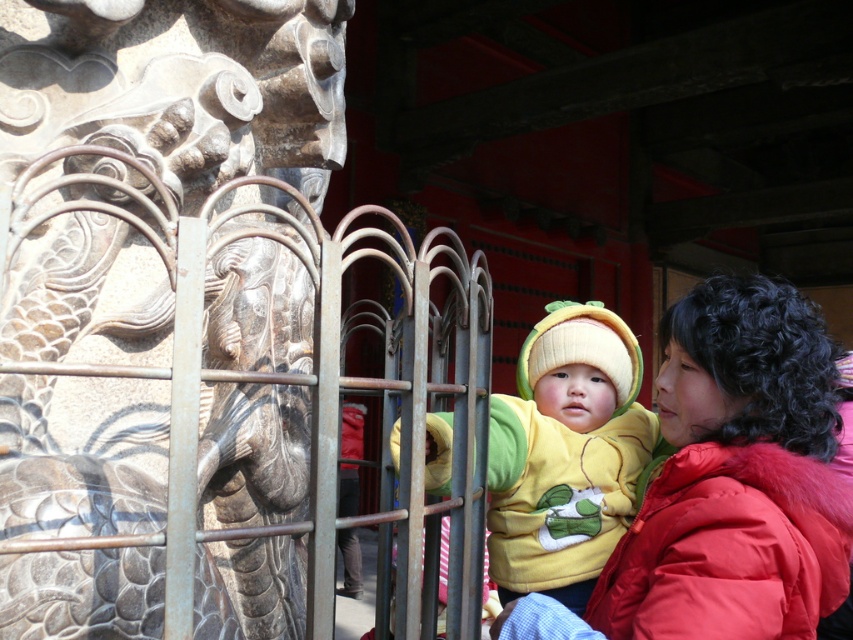
Where is `red puffy coat at right`? red puffy coat at right is located at coordinates (735, 477).

In the scene shown: Who is positioned more to the right, red puffy coat at right or yellow fleece at center?

red puffy coat at right is more to the right.

Is point (645, 493) positioned in front of point (426, 433)?

No, (645, 493) is behind (426, 433).

Where is `red puffy coat at right`? The width and height of the screenshot is (853, 640). red puffy coat at right is located at coordinates (735, 477).

Does point (276, 449) lie behind point (712, 276)?

Yes, point (276, 449) is behind point (712, 276).

Who is more forward, (339, 13) or (712, 465)?

Point (712, 465)

Where is `stone dragon at center`? stone dragon at center is located at coordinates (178, 88).

You are a GUI agent. You are given a task and a screenshot of the screen. Output one action in this format:
    pyautogui.click(x=<x>, y=<y>)
    Task: Click on the stone dragon at center
    
    Given the screenshot: What is the action you would take?
    pyautogui.click(x=178, y=88)

Does point (39, 264) come behind point (613, 364)?

No, it is in front of (613, 364).

From the picture: Is stone dragon at center further to camera compared to yellow fleece at center?

No, stone dragon at center is closer to the viewer.

Where is `stone dragon at center`? stone dragon at center is located at coordinates (178, 88).

The image size is (853, 640). In order to click on stone dragon at center in this screenshot , I will do [178, 88].